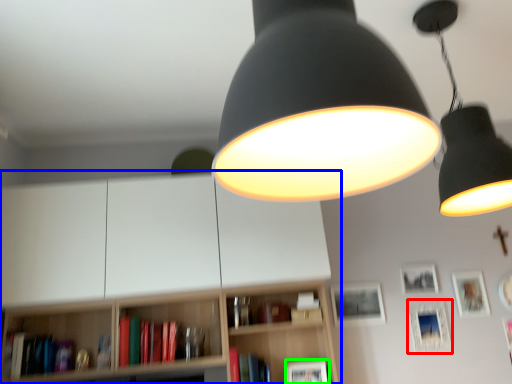
Question: Which object is positioned closest to picture frame (highlighted by a red box)? Select from bookcase (highlighted by a blue box) and picture frame (highlighted by a green box).

Choices:
 (A) bookcase
 (B) picture frame

Answer: (B)